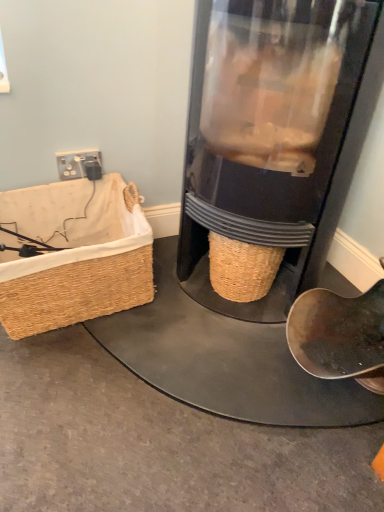
Where is `vacant area that is in front of woven straw picnic basket at left`? vacant area that is in front of woven straw picnic basket at left is located at coordinates (86, 388).